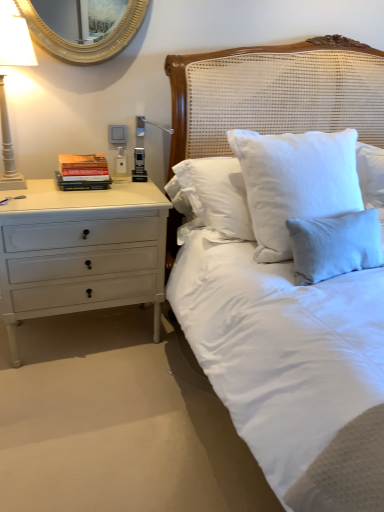
I want to click on vacant area that is in front of hardcover books at left, so click(x=77, y=195).